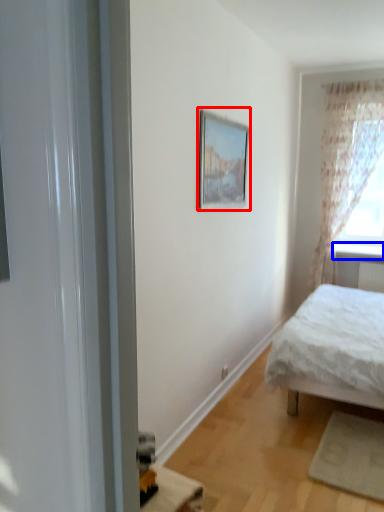
Question: Which of the following is the farthest to the observer, picture frame (highlighted by a red box) or window sill (highlighted by a blue box)?

Choices:
 (A) picture frame
 (B) window sill

Answer: (B)